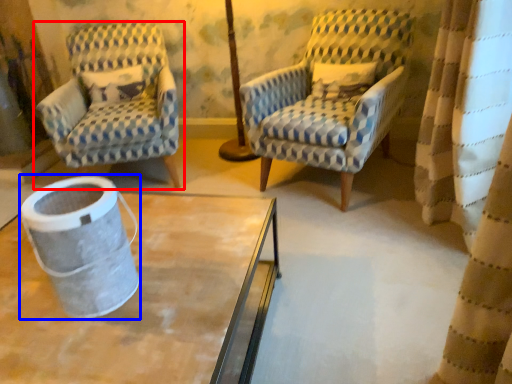
Question: Which object appears farthest to the camera in this image, chair (highlighted by a red box) or gray (highlighted by a blue box)?

Choices:
 (A) chair
 (B) gray

Answer: (A)